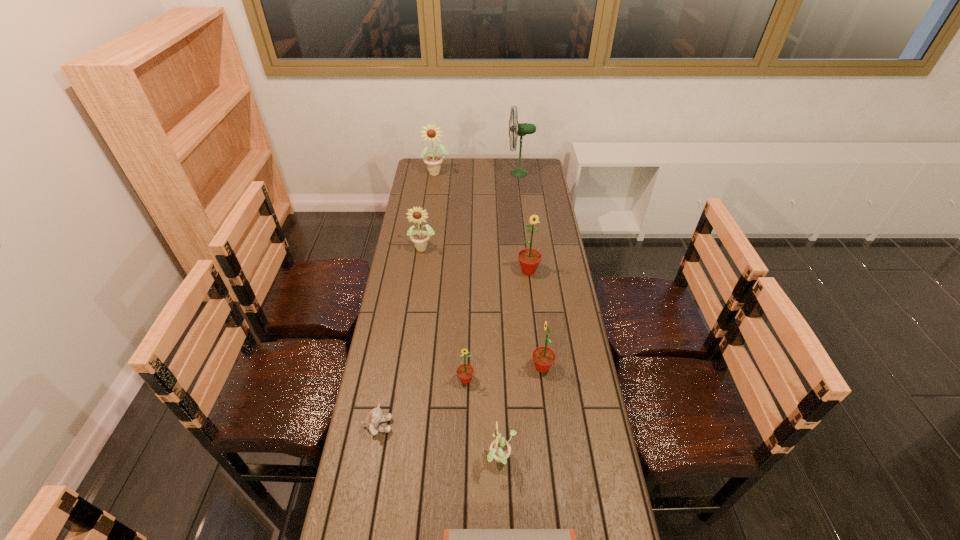
I want to click on the nearest sunflower, so click(x=500, y=449).

You are a GUI agent. You are given a task and a screenshot of the screen. Output one action in this format:
    pyautogui.click(x=<x>, y=<y>)
    Task: Click on the leftmost green sunflower
    This screenshot has width=960, height=540.
    Given the screenshot: What is the action you would take?
    pyautogui.click(x=465, y=372)

Where is `the smallest green sunflower`? The width and height of the screenshot is (960, 540). the smallest green sunflower is located at coordinates (465, 372).

Locate an element on the screen. Image resolution: width=960 pixels, height=540 pixels. gray teddy bear is located at coordinates (376, 416).

Where is `the seventh farthest object`? The width and height of the screenshot is (960, 540). the seventh farthest object is located at coordinates (376, 416).

Identify the location of vacant space situated 0.100m on the front-facing side of the tallest object. (489, 173).

This screenshot has height=540, width=960. What are the coordinates of `vacant space located on the front-facing side of the tallest object` in the screenshot? It's located at (462, 173).

The width and height of the screenshot is (960, 540). Find the location of `vacant region located 0.340m on the front-facing side of the tallest object`. vacant region located 0.340m on the front-facing side of the tallest object is located at coordinates (445, 173).

Identify the location of vacant space located on the front-facing side of the farthest yellow sunflower. This screenshot has height=540, width=960. (432, 210).

Locate an element on the screen. vacant region located 0.230m on the face of the fourth nearest sunflower is located at coordinates (534, 321).